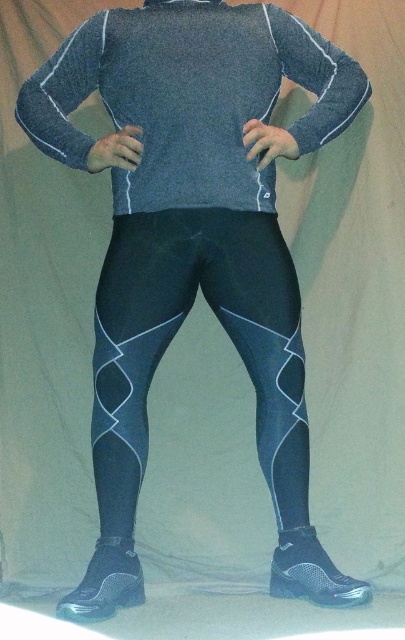
Does matte gray sweater at center come behind matte black leggings at center?

No.

Is point (193, 54) closer to viewer compared to point (294, 486)?

Yes, point (193, 54) is closer to viewer.

Between point (253, 93) and point (112, 500), which one is positioned in front?

Point (112, 500) is in front.

Where is `matte gray sweater at center`? matte gray sweater at center is located at coordinates (189, 97).